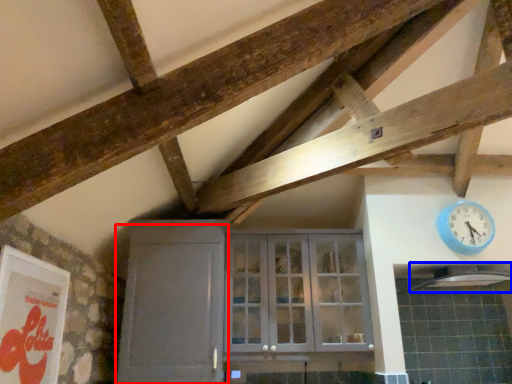
Question: Which of the following is the farthest to the observer, door (highlighted by a red box) or exhaust hood (highlighted by a blue box)?

Choices:
 (A) door
 (B) exhaust hood

Answer: (B)